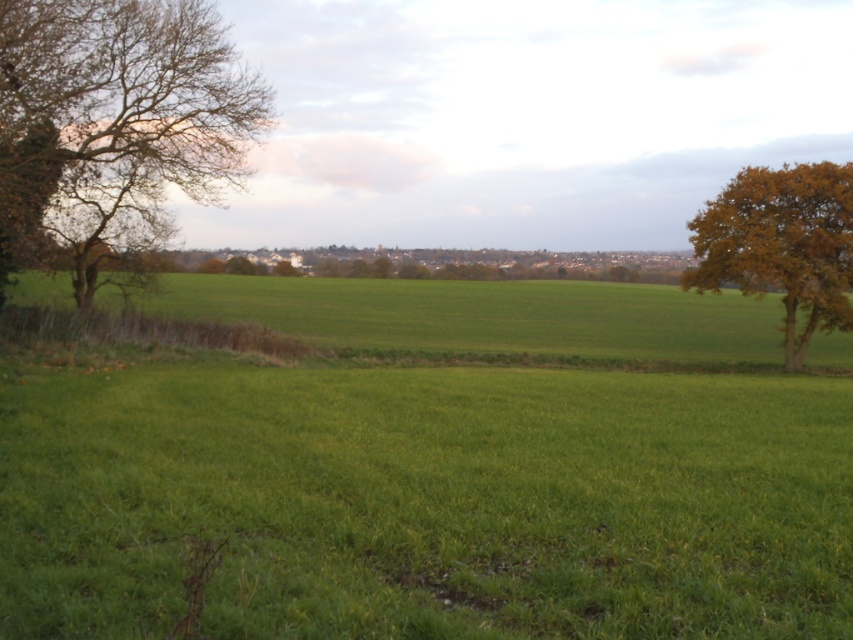
Question: Does green grassy field at center appear over bare branches at left?

Choices:
 (A) yes
 (B) no

Answer: (B)

Question: Is green grassy field at center positioned at the back of golden-brown leafy tree at right?

Choices:
 (A) yes
 (B) no

Answer: (B)

Question: Which point appears closest to the camera in this image?

Choices:
 (A) (181, 426)
 (B) (792, 218)
 (C) (126, 184)

Answer: (A)

Question: Which object is farther from the camera taking this photo?

Choices:
 (A) golden-brown leafy tree at right
 (B) bare branches at left
 (C) green grassy field at center

Answer: (A)

Question: Does bare branches at left appear over golden-brown leafy tree at right?

Choices:
 (A) no
 (B) yes

Answer: (A)

Question: Which is farther from the bare branches at left?

Choices:
 (A) green grassy field at center
 (B) golden-brown leafy tree at right

Answer: (B)